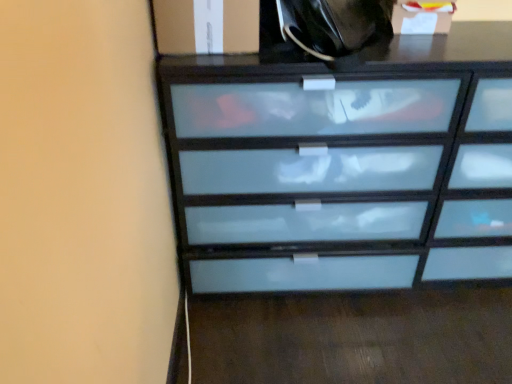
The height and width of the screenshot is (384, 512). What are the coordinates of `frosted glass chest of drawers at center` in the screenshot? It's located at (345, 165).

The width and height of the screenshot is (512, 384). What do you see at coordinates (334, 25) in the screenshot?
I see `black glossy tote bag at upper center` at bounding box center [334, 25].

Measure the distance between white frosted glass cabinet at upper left, the second cabinetry when ordered from right to left, and camera.

The depth of white frosted glass cabinet at upper left, the second cabinetry when ordered from right to left, is 3.42 feet.

This screenshot has width=512, height=384. I want to click on frosted glass chest of drawers at center, so click(x=345, y=165).

Based on the photo, considering the relative positions of frosted glass chest of drawers at center and white frosted glass cabinet at upper left, placed as the 1th cabinetry when sorted from left to right, in the image provided, is frosted glass chest of drawers at center in front of white frosted glass cabinet at upper left, placed as the 1th cabinetry when sorted from left to right,?

Yes, frosted glass chest of drawers at center is closer to the viewer.

From a real-world perspective, does frosted glass chest of drawers at center sit lower than white frosted glass cabinet at upper left, placed as the 1th cabinetry when sorted from left to right?

Yes, from a real-world perspective, frosted glass chest of drawers at center is below white frosted glass cabinet at upper left, placed as the 1th cabinetry when sorted from left to right.

From a real-world perspective, starting from the frosted glass chest of drawers at center, which cabinetry is the 1st one vertically above it? Please provide its 2D coordinates.

[(206, 27)]

Considering the relative sizes of white frosted glass cabinet at upper left, placed as the 1th cabinetry when sorted from left to right, and white frosted glass cabinet at upper right, positioned as the 1th cabinetry in right-to-left order, in the image provided, is white frosted glass cabinet at upper left, placed as the 1th cabinetry when sorted from left to right, shorter than white frosted glass cabinet at upper right, positioned as the 1th cabinetry in right-to-left order,?

Correct, white frosted glass cabinet at upper left, placed as the 1th cabinetry when sorted from left to right, is not as tall as white frosted glass cabinet at upper right, positioned as the 1th cabinetry in right-to-left order.

Considering the relative positions of white frosted glass cabinet at upper left, placed as the 1th cabinetry when sorted from left to right, and white frosted glass cabinet at upper right, which is the 2th cabinetry from left to right, in the image provided, is white frosted glass cabinet at upper left, placed as the 1th cabinetry when sorted from left to right, in front of white frosted glass cabinet at upper right, which is the 2th cabinetry from left to right,?

Yes, white frosted glass cabinet at upper left, placed as the 1th cabinetry when sorted from left to right, is closer to the camera.

Identify the location of cabinetry to the left of white frosted glass cabinet at upper right, which is the 2th cabinetry from left to right. This screenshot has width=512, height=384. (206, 27).

Does point (191, 53) appear closer or farther from the camera than point (402, 14)?

Clearly, point (191, 53) is closer to the camera than point (402, 14).

From a real-world perspective, between white frosted glass cabinet at upper right, positioned as the 1th cabinetry in right-to-left order, and black glossy tote bag at upper center, who is vertically higher?

white frosted glass cabinet at upper right, positioned as the 1th cabinetry in right-to-left order, from a real-world perspective.

Between white frosted glass cabinet at upper right, positioned as the 1th cabinetry in right-to-left order, and black glossy tote bag at upper center, which one has more height?

Standing taller between the two is white frosted glass cabinet at upper right, positioned as the 1th cabinetry in right-to-left order.

Consider the image. Is white frosted glass cabinet at upper right, positioned as the 1th cabinetry in right-to-left order, directly adjacent to black glossy tote bag at upper center?

No, white frosted glass cabinet at upper right, positioned as the 1th cabinetry in right-to-left order, is not in contact with black glossy tote bag at upper center.

Consider the image. Which is more to the left, white frosted glass cabinet at upper right, which is the 2th cabinetry from left to right, or black glossy tote bag at upper center?

black glossy tote bag at upper center.

Which of these two, frosted glass chest of drawers at center or black glossy tote bag at upper center, is thinner?

black glossy tote bag at upper center is thinner.

Is frosted glass chest of drawers at center facing towards black glossy tote bag at upper center?

No, frosted glass chest of drawers at center is not facing towards black glossy tote bag at upper center.

Considering their positions, is frosted glass chest of drawers at center located in front of or behind black glossy tote bag at upper center?

Visually, frosted glass chest of drawers at center is located behind black glossy tote bag at upper center.

In the scene shown: Considering the sizes of objects frosted glass chest of drawers at center and black glossy tote bag at upper center in the image provided, who is taller, frosted glass chest of drawers at center or black glossy tote bag at upper center?

Standing taller between the two is frosted glass chest of drawers at center.

Considering the relative sizes of black glossy tote bag at upper center and frosted glass chest of drawers at center in the image provided, is black glossy tote bag at upper center taller than frosted glass chest of drawers at center?

Incorrect, the height of black glossy tote bag at upper center is not larger of that of frosted glass chest of drawers at center.

Is black glossy tote bag at upper center oriented away from frosted glass chest of drawers at center?

That's not correct — black glossy tote bag at upper center is not looking away from frosted glass chest of drawers at center.

Does black glossy tote bag at upper center touch frosted glass chest of drawers at center?

No, black glossy tote bag at upper center is not making contact with frosted glass chest of drawers at center.

Between black glossy tote bag at upper center and frosted glass chest of drawers at center, which one appears on the right side from the viewer's perspective?

frosted glass chest of drawers at center.

From the picture: Is white frosted glass cabinet at upper left, placed as the 1th cabinetry when sorted from left to right, positioned in front of frosted glass chest of drawers at center?

No.

Which object is positioned more to the right, white frosted glass cabinet at upper left, the second cabinetry when ordered from right to left, or frosted glass chest of drawers at center?

From the viewer's perspective, frosted glass chest of drawers at center appears more on the right side.

From the image's perspective, is white frosted glass cabinet at upper left, the second cabinetry when ordered from right to left, located above or below frosted glass chest of drawers at center?

white frosted glass cabinet at upper left, the second cabinetry when ordered from right to left, is above frosted glass chest of drawers at center.

Who is smaller, white frosted glass cabinet at upper left, the second cabinetry when ordered from right to left, or black glossy tote bag at upper center?

white frosted glass cabinet at upper left, the second cabinetry when ordered from right to left.

From a real-world perspective, is white frosted glass cabinet at upper left, the second cabinetry when ordered from right to left, positioned over black glossy tote bag at upper center based on gravity?

No.

Which of these two, white frosted glass cabinet at upper left, placed as the 1th cabinetry when sorted from left to right, or black glossy tote bag at upper center, is wider?

white frosted glass cabinet at upper left, placed as the 1th cabinetry when sorted from left to right, is wider.

Is white frosted glass cabinet at upper left, placed as the 1th cabinetry when sorted from left to right, taller than black glossy tote bag at upper center?

No.

This screenshot has height=384, width=512. Identify the location of the chest of drawers that is under the white frosted glass cabinet at upper left, placed as the 1th cabinetry when sorted from left to right (from a real-world perspective). (345, 165).

Locate an element on the screen. This screenshot has height=384, width=512. cabinetry that is on the left side of white frosted glass cabinet at upper right, which is the 2th cabinetry from left to right is located at coordinates (206, 27).

Which object lies further to the anchor point frosted glass chest of drawers at center, white frosted glass cabinet at upper left, the second cabinetry when ordered from right to left, or white frosted glass cabinet at upper right, which is the 2th cabinetry from left to right?

white frosted glass cabinet at upper right, which is the 2th cabinetry from left to right, is positioned further to the anchor frosted glass chest of drawers at center.

Based on their spatial positions, is frosted glass chest of drawers at center or black glossy tote bag at upper center further from white frosted glass cabinet at upper left, the second cabinetry when ordered from right to left?

Among the two, frosted glass chest of drawers at center is located further to white frosted glass cabinet at upper left, the second cabinetry when ordered from right to left.

When comparing their distances from black glossy tote bag at upper center, does frosted glass chest of drawers at center or white frosted glass cabinet at upper left, placed as the 1th cabinetry when sorted from left to right, seem further?

Among the two, frosted glass chest of drawers at center is located further to black glossy tote bag at upper center.

Consider the image. Based on their spatial positions, is white frosted glass cabinet at upper right, positioned as the 1th cabinetry in right-to-left order, or white frosted glass cabinet at upper left, placed as the 1th cabinetry when sorted from left to right, further from black glossy tote bag at upper center?

Among the two, white frosted glass cabinet at upper left, placed as the 1th cabinetry when sorted from left to right, is located further to black glossy tote bag at upper center.

In the scene shown: From the image, which object appears to be nearer to white frosted glass cabinet at upper left, the second cabinetry when ordered from right to left, frosted glass chest of drawers at center or white frosted glass cabinet at upper right, positioned as the 1th cabinetry in right-to-left order?

frosted glass chest of drawers at center is positioned closer to the anchor white frosted glass cabinet at upper left, the second cabinetry when ordered from right to left.

Looking at the image, which one is located further to frosted glass chest of drawers at center, black glossy tote bag at upper center or white frosted glass cabinet at upper left, the second cabinetry when ordered from right to left?

Among the two, white frosted glass cabinet at upper left, the second cabinetry when ordered from right to left, is located further to frosted glass chest of drawers at center.

Based on their spatial positions, is black glossy tote bag at upper center or white frosted glass cabinet at upper right, which is the 2th cabinetry from left to right, further from frosted glass chest of drawers at center?

Among the two, white frosted glass cabinet at upper right, which is the 2th cabinetry from left to right, is located further to frosted glass chest of drawers at center.

From the image, which object appears to be farther from frosted glass chest of drawers at center, white frosted glass cabinet at upper left, the second cabinetry when ordered from right to left, or black glossy tote bag at upper center?

Based on the image, white frosted glass cabinet at upper left, the second cabinetry when ordered from right to left, appears to be further to frosted glass chest of drawers at center.

Where is `tote bag between white frosted glass cabinet at upper left, placed as the 1th cabinetry when sorted from left to right, and frosted glass chest of drawers at center from left to right`? tote bag between white frosted glass cabinet at upper left, placed as the 1th cabinetry when sorted from left to right, and frosted glass chest of drawers at center from left to right is located at coordinates (334, 25).

Where is `tote bag between white frosted glass cabinet at upper right, which is the 2th cabinetry from left to right, and frosted glass chest of drawers at center from top to bottom`? tote bag between white frosted glass cabinet at upper right, which is the 2th cabinetry from left to right, and frosted glass chest of drawers at center from top to bottom is located at coordinates (334, 25).

What are the coordinates of `tote bag located between white frosted glass cabinet at upper left, placed as the 1th cabinetry when sorted from left to right, and white frosted glass cabinet at upper right, positioned as the 1th cabinetry in right-to-left order, in the left-right direction` in the screenshot? It's located at (334, 25).

Locate an element on the screen. The width and height of the screenshot is (512, 384). the chest of drawers situated between white frosted glass cabinet at upper left, the second cabinetry when ordered from right to left, and white frosted glass cabinet at upper right, which is the 2th cabinetry from left to right, from left to right is located at coordinates (345, 165).